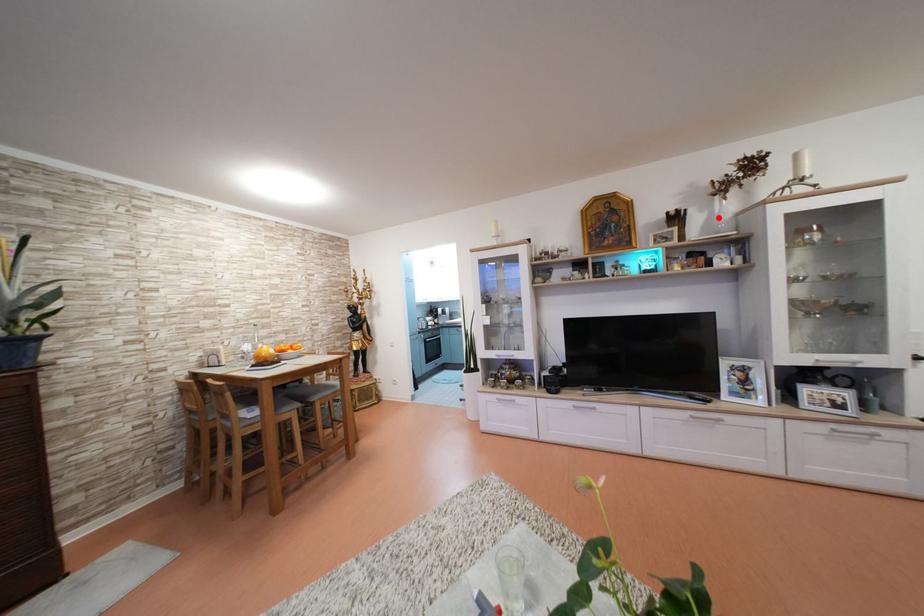
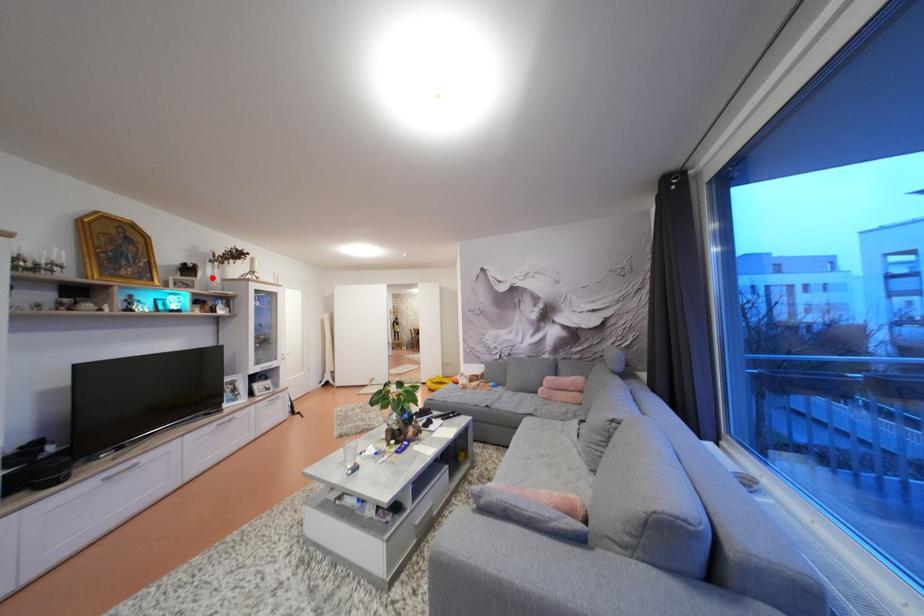
I am providing you with two images of the same scene from different viewpoints. A red point is marked on the first image and another point is marked on the second image. Does the point marked in image1 correspond to the same location as the one in image2?

Yes